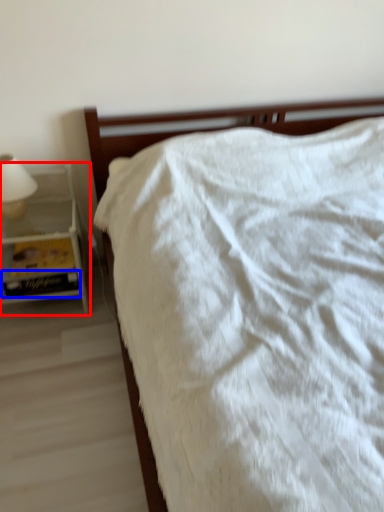
Question: Which of the following is the closest to the observer, nightstand (highlighted by a red box) or paperback book (highlighted by a blue box)?

Choices:
 (A) nightstand
 (B) paperback book

Answer: (A)